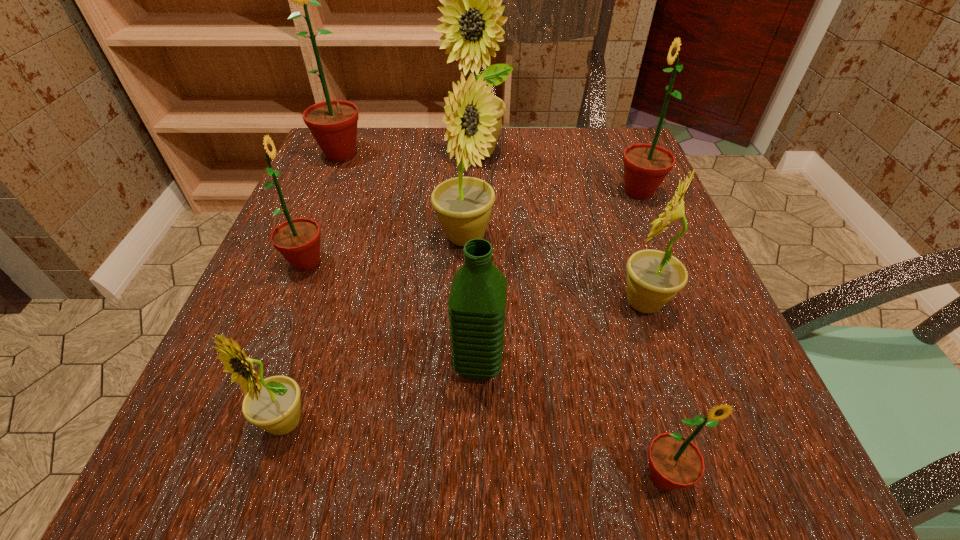
Identify the location of the leftmost yellow sunflower. This screenshot has height=540, width=960. (273, 404).

You are a GUI agent. You are given a task and a screenshot of the screen. Output one action in this format:
    pyautogui.click(x=<x>, y=<y>)
    Task: Click on the smallest yellow sunflower
    Image resolution: width=960 pixels, height=540 pixels.
    Given the screenshot: What is the action you would take?
    pyautogui.click(x=273, y=404)

What are the coordinates of `the nearest object` in the screenshot? It's located at (675, 462).

The height and width of the screenshot is (540, 960). Find the location of `the third green sunflower from left to right`. the third green sunflower from left to right is located at coordinates (675, 462).

Where is `free space located on the face of the biggest yellow sunflower`? This screenshot has width=960, height=540. free space located on the face of the biggest yellow sunflower is located at coordinates (472, 279).

You are a GUI agent. You are given a task and a screenshot of the screen. Output one action in this format:
    pyautogui.click(x=<x>, y=<y>)
    Task: Click on the vacant area located 0.150m on the face of the farthest green sunflower
    This screenshot has height=540, width=960.
    Given the screenshot: What is the action you would take?
    318,209

This screenshot has width=960, height=540. Find the location of `vacant area located 0.300m on the face of the third nearest yellow sunflower`. vacant area located 0.300m on the face of the third nearest yellow sunflower is located at coordinates (660, 238).

Identify the location of vacant space located on the face of the rightmost green sunflower. The width and height of the screenshot is (960, 540). (566, 192).

The image size is (960, 540). Find the location of `free location located 0.260m on the face of the rightmost green sunflower`. free location located 0.260m on the face of the rightmost green sunflower is located at coordinates (490, 192).

You are a GUI agent. You are given a task and a screenshot of the screen. Output one action in this format:
    pyautogui.click(x=<x>, y=<y>)
    Task: Click on the vacant space situated 0.380m on the face of the rightmost green sunflower
    This screenshot has height=540, width=960.
    Given the screenshot: What is the action you would take?
    pyautogui.click(x=431, y=192)